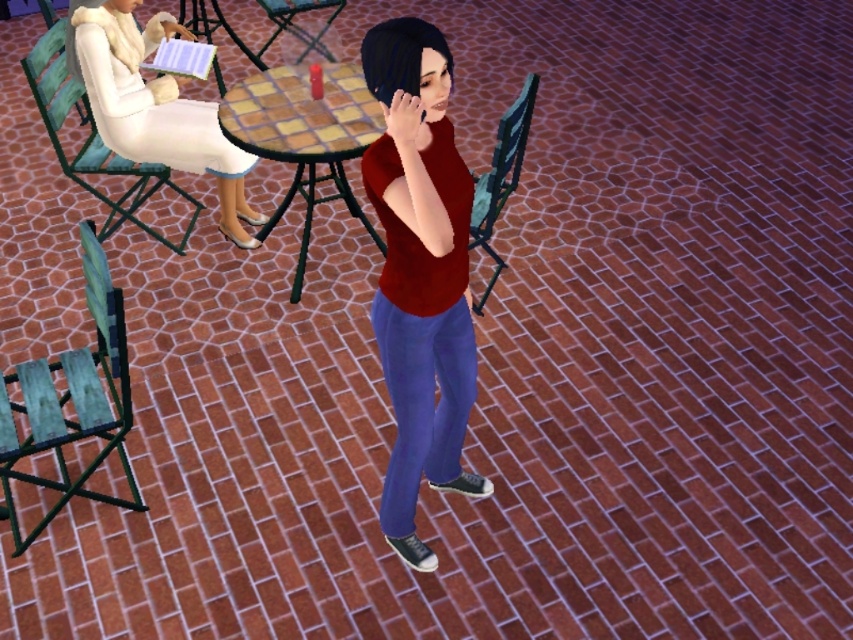
In the scene shown: You are standing at the entrance of the outdoor cafe and see the checkerboard wood table at center and the green fabric chair at center. Which object is positioned to the right from your perspective?

The checkerboard wood table at center is to the right of the green fabric chair at center, so from your perspective at the entrance, the checkerboard wood table at center is positioned to the right.

You are standing at the point labeled point (517, 144) and want to walk to the entrance of the outdoor cafe. There is a person at point (15, 410). Based on their position relative to you, can you walk directly towards the entrance without going around them?

Since point (15, 410) is in front of point (517, 144), the person at point (15, 410) is blocking your path. You will need to go around them to reach the entrance.